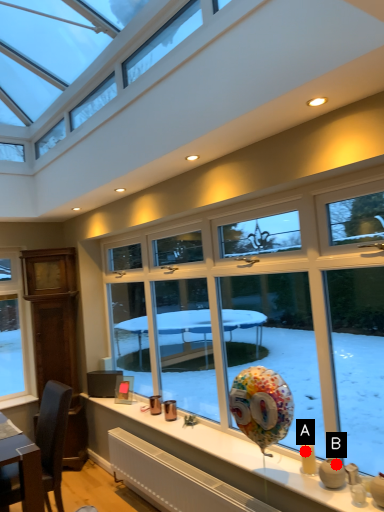
Question: Two points are circled on the image, labeled by A and B beside each circle. Among these points, which one is farthest from the camera?

Choices:
 (A) A is further
 (B) B is further

Answer: (A)